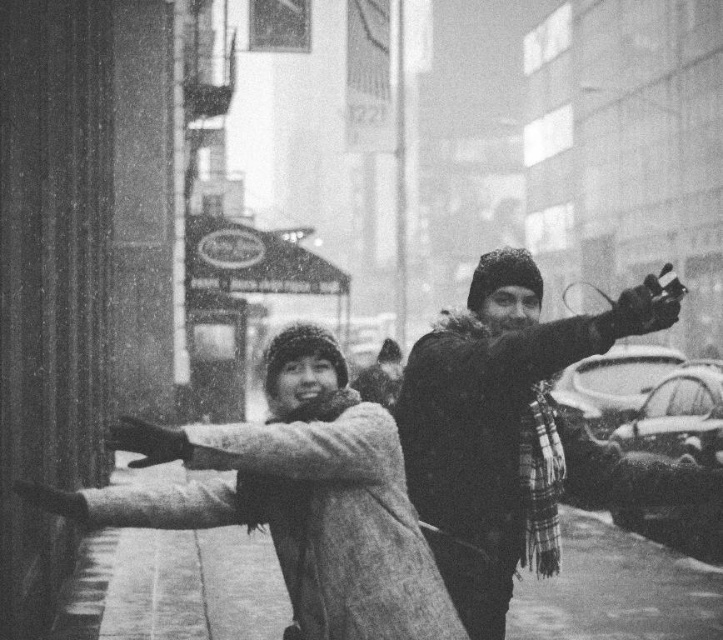
Which is above, fuzzy black coat at right or smooth concrete pavement at lower center?

fuzzy black coat at right is higher up.

Is fuzzy black coat at right wider than smooth concrete pavement at lower center?

No, fuzzy black coat at right is not wider than smooth concrete pavement at lower center.

The image size is (723, 640). I want to click on fuzzy black coat at right, so click(505, 429).

Does fuzzy wool coat at center have a greater width compared to fuzzy black coat at right?

Yes.

Where is `fuzzy wool coat at center`? This screenshot has height=640, width=723. fuzzy wool coat at center is located at coordinates (295, 497).

Who is lower down, fuzzy wool coat at center or smooth concrete pavement at lower center?

smooth concrete pavement at lower center

Where is `fuzzy wool coat at center`? fuzzy wool coat at center is located at coordinates (295, 497).